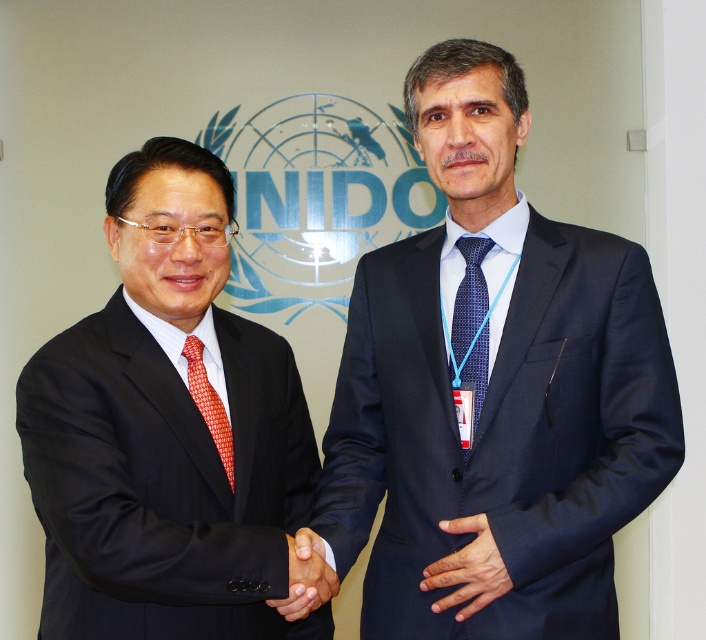
Question: Which of the following is the closest to the observer?

Choices:
 (A) (305, 586)
 (B) (61, 353)

Answer: (A)

Question: Does dark blue suit at center have a smaller size compared to black glossy hand at center?

Choices:
 (A) yes
 (B) no

Answer: (B)

Question: Does dark blue suit at center come in front of black glossy hand at center?

Choices:
 (A) no
 (B) yes

Answer: (A)

Question: Which point is closer to the camera?

Choices:
 (A) (486, 250)
 (B) (317, 596)

Answer: (B)

Question: Which point appears farthest from the camera in this image?

Choices:
 (A) click(x=225, y=442)
 (B) click(x=287, y=536)
 (C) click(x=527, y=353)

Answer: (C)

Question: Observing the image, what is the correct spatial positioning of dark blue fabric hand at center in reference to black glossy hand at center?

Choices:
 (A) right
 (B) left

Answer: (A)